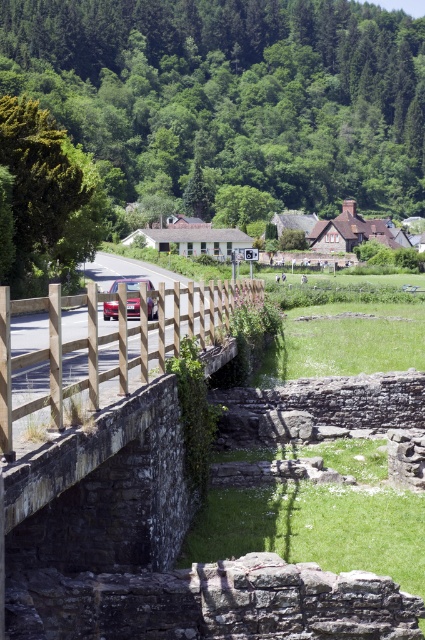
Question: Among these objects, which one is farthest from the camera?

Choices:
 (A) metallic pink car at center
 (B) stone bridge at center

Answer: (A)

Question: Among these objects, which one is farthest from the camera?

Choices:
 (A) metallic pink car at center
 (B) stone bridge at center

Answer: (A)

Question: Does stone bridge at center have a lesser width compared to metallic pink car at center?

Choices:
 (A) no
 (B) yes

Answer: (B)

Question: Does stone bridge at center have a smaller size compared to metallic pink car at center?

Choices:
 (A) no
 (B) yes

Answer: (B)

Question: Observing the image, what is the correct spatial positioning of stone bridge at center in reference to metallic pink car at center?

Choices:
 (A) above
 (B) below

Answer: (B)